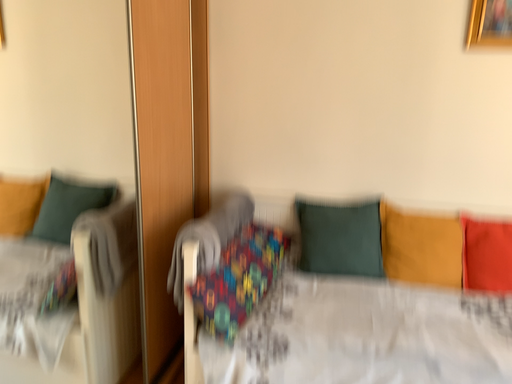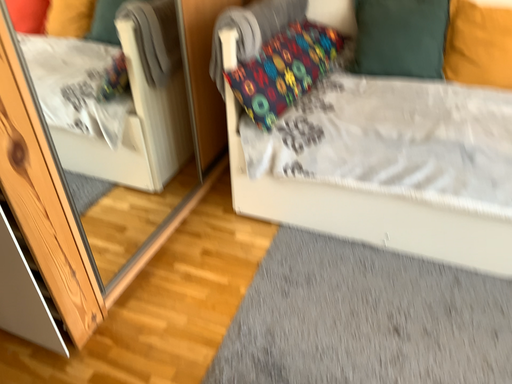
Question: How did the camera likely rotate when shooting the video?

Choices:
 (A) rotated left
 (B) rotated right

Answer: (A)